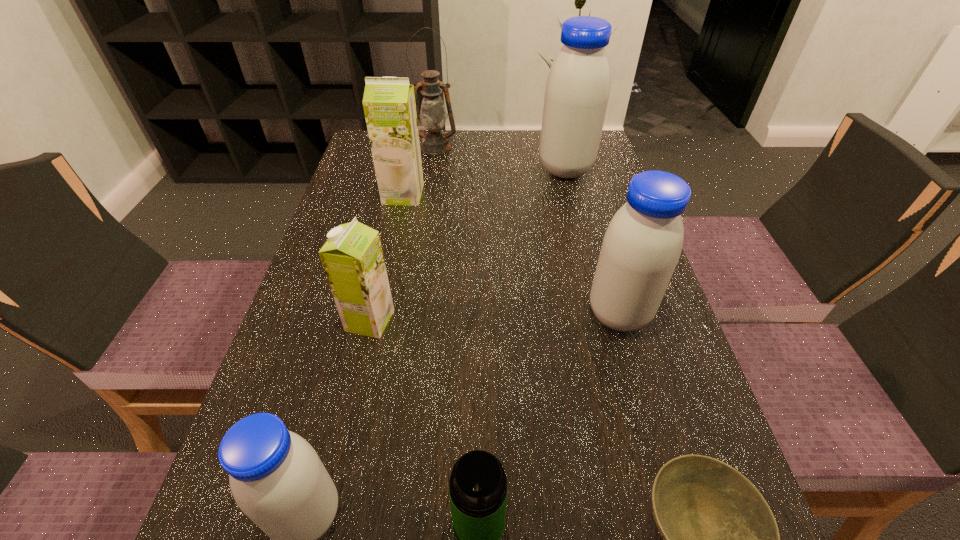
This screenshot has width=960, height=540. I want to click on empty space between the second nearest blue soya milk and the farthest blue soya milk, so click(x=592, y=241).

At what (x,y) coordinates should I click in order to perform the action: click on the fourth closest object to the shortest object. Please return your answer as a coordinate pair (x, y). Looking at the image, I should click on (352, 258).

Point out which object is positioned as the seventh nearest to the biggest blue soya milk. Please provide its 2D coordinates. Your answer should be formatted as a tuple, i.e. [(x, y)], where the tuple contains the x and y coordinates of a point satisfying the conditions above.

[(277, 479)]

Locate which soya milk ranks in proximity to the biggest blue soya milk. Please provide its 2D coordinates. Your answer should be formatted as a tuple, i.e. [(x, y)], where the tuple contains the x and y coordinates of a point satisfying the conditions above.

[(389, 105)]

This screenshot has height=540, width=960. Find the location of `soya milk object that ranks as the fourth closest to the bowl`. soya milk object that ranks as the fourth closest to the bowl is located at coordinates (389, 105).

Locate an element on the screen. The width and height of the screenshot is (960, 540). blue soya milk that stands as the closest to the farthest blue soya milk is located at coordinates (642, 245).

Image resolution: width=960 pixels, height=540 pixels. Find the location of `blue soya milk that is the third closest one to the bigger green soya milk`. blue soya milk that is the third closest one to the bigger green soya milk is located at coordinates (277, 479).